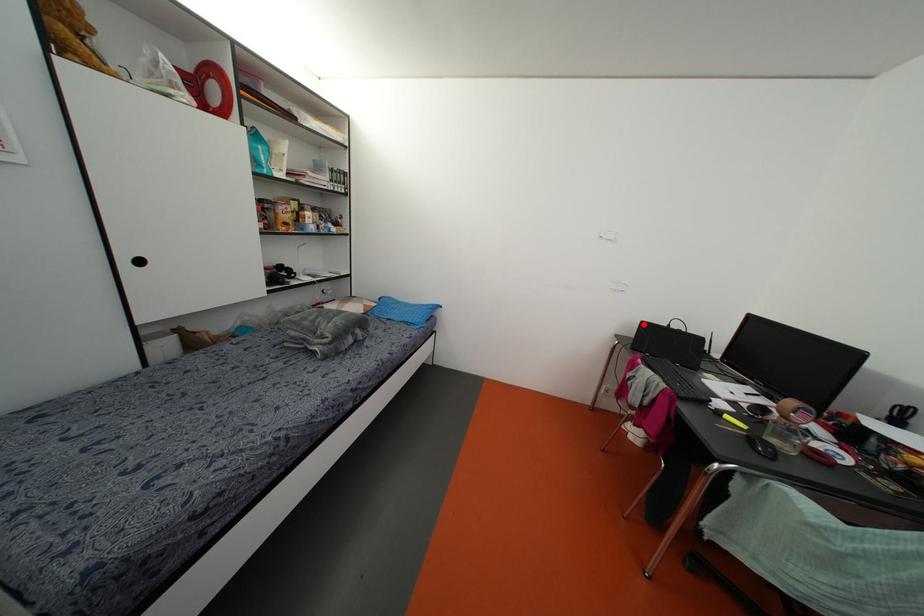
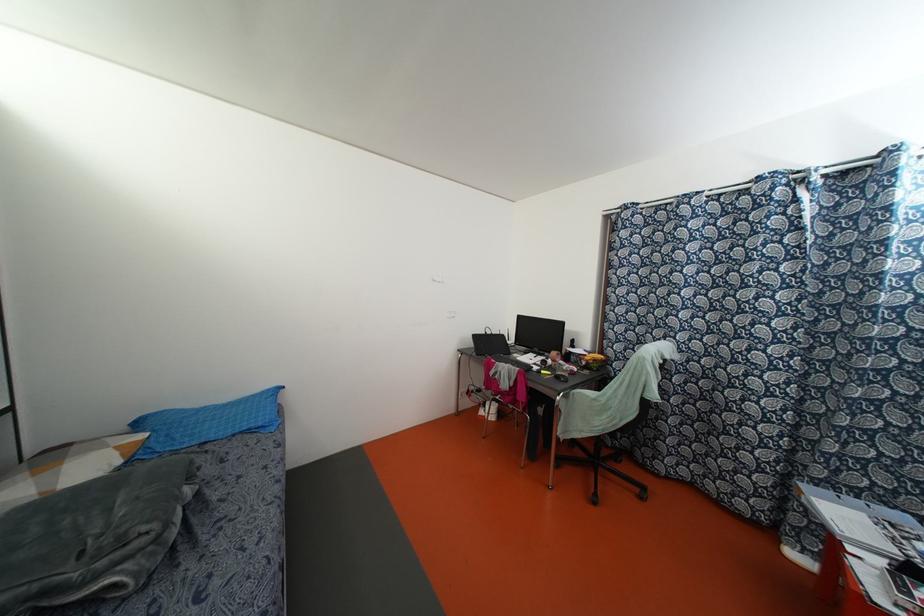
Question: I am providing you with two images of the same scene from different viewpoints. Given a red point in image1, look at the same physical point in image2. Is it:

Choices:
 (A) Closer to the viewpoint
 (B) Farther from the viewpoint

Answer: (B)